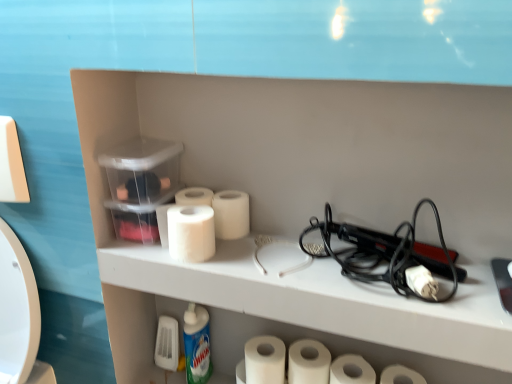
Where is `free point to the right of white matte toilet paper at center, which ranks as the 5th toilet paper in right-to-left order`? free point to the right of white matte toilet paper at center, which ranks as the 5th toilet paper in right-to-left order is located at coordinates (293, 244).